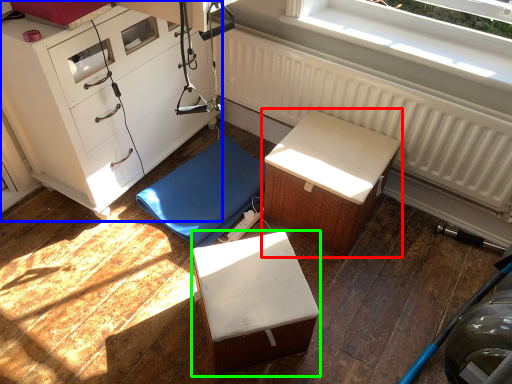
Question: Based on their relative distances, which object is nearer to furniture (highlighted by a red box)? Choose from chest of drawers (highlighted by a blue box) and furniture (highlighted by a green box).

Choices:
 (A) chest of drawers
 (B) furniture

Answer: (B)